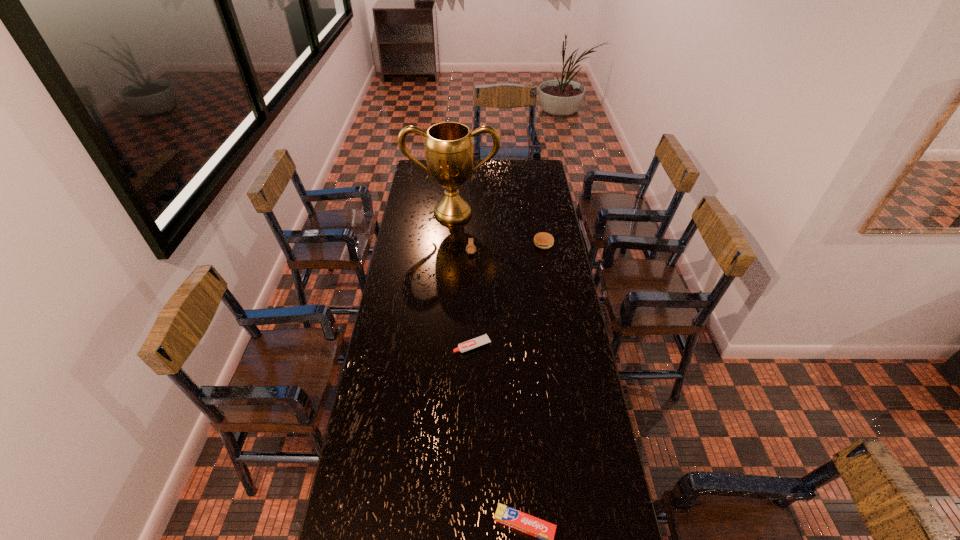
The image size is (960, 540). In order to click on vacant area between the fourth shortest object and the patty in this screenshot , I will do `click(507, 248)`.

The image size is (960, 540). In order to click on object that can be found as the fourth closest to the rightmost object in this screenshot , I will do click(531, 525).

This screenshot has width=960, height=540. Find the location of `the fourth closest object to the farthest object`. the fourth closest object to the farthest object is located at coordinates (531, 525).

Locate an element on the screen. Image resolution: width=960 pixels, height=540 pixels. vacant position in the image that satisfies the following two spatial constraints: 1. on the face of the second tallest object; 2. on the right side of the fourth farthest object is located at coordinates (469, 346).

You are a GUI agent. You are given a task and a screenshot of the screen. Output one action in this format:
    pyautogui.click(x=<x>, y=<y>)
    Task: Click on the free space that satisfies the following two spatial constraints: 1. on the face of the fourth shortest object; 2. on the left side of the second nearest object
    The width and height of the screenshot is (960, 540).
    Given the screenshot: What is the action you would take?
    pyautogui.click(x=469, y=346)

Locate an element on the screen. The image size is (960, 540). free region that satisfies the following two spatial constraints: 1. on the surface of the farthest object with symbols; 2. on the right side of the farther toothpaste is located at coordinates (443, 346).

Where is `free space that satisfies the following two spatial constraints: 1. on the surface of the trophy cup with symbols; 2. on the left side of the rightmost object`? free space that satisfies the following two spatial constraints: 1. on the surface of the trophy cup with symbols; 2. on the left side of the rightmost object is located at coordinates [450, 244].